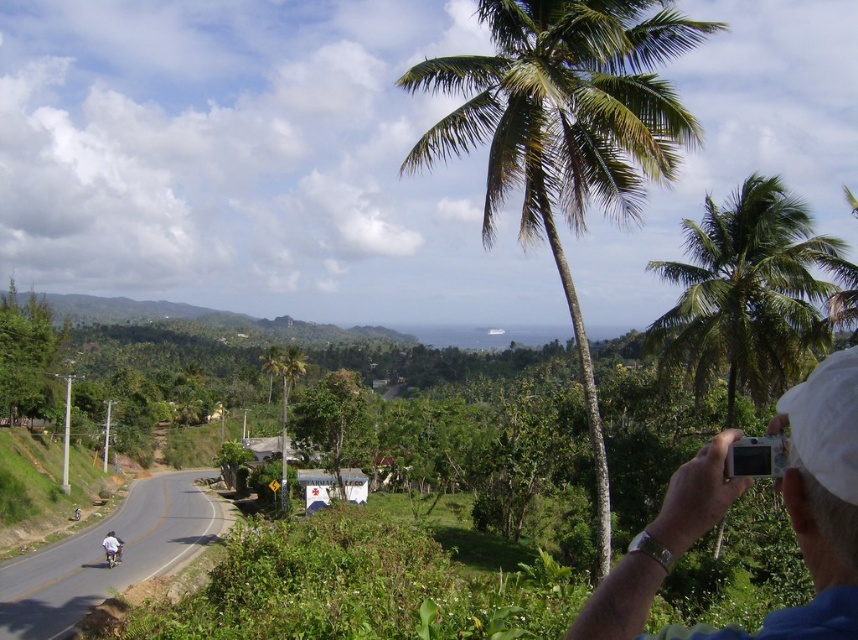
Question: Does white cloth cap at upper right have a smaller size compared to white fabric helmet at lower left?

Choices:
 (A) yes
 (B) no

Answer: (A)

Question: Among these objects, which one is nearest to the camera?

Choices:
 (A) green leafy coconut tree at upper center
 (B) white fabric helmet at lower left
 (C) white cloth cap at upper right

Answer: (C)

Question: Where is white cloth cap at upper right located in relation to green leafy coconut tree at upper right in the image?

Choices:
 (A) above
 (B) below

Answer: (B)

Question: Among these objects, which one is farthest from the camera?

Choices:
 (A) green leafy coconut tree at upper right
 (B) white cloth cap at upper right
 (C) white fabric helmet at lower left
 (D) green leafy coconut tree at upper center

Answer: (C)

Question: Is green leafy coconut tree at upper center bigger than white cloth cap at upper right?

Choices:
 (A) no
 (B) yes

Answer: (B)

Question: Which of these objects is positioned closest to the white cloth cap at upper right?

Choices:
 (A) green leafy coconut tree at upper right
 (B) white fabric helmet at lower left
 (C) green leafy coconut tree at upper center

Answer: (C)